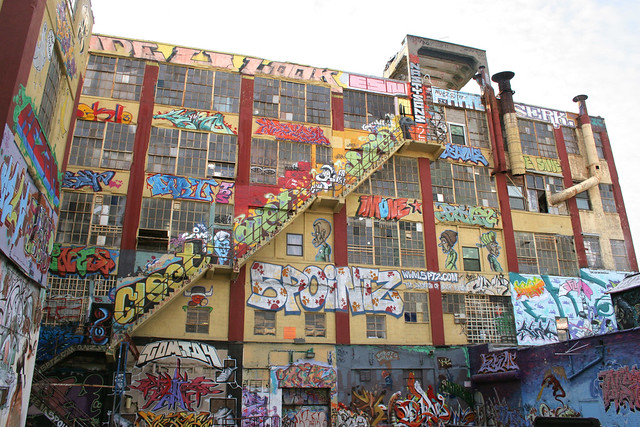
The image size is (640, 427). In order to click on 5th row of stairs in this screenshot , I will do `click(362, 181)`.